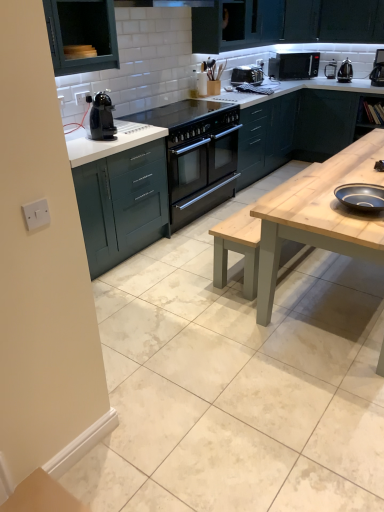
Question: Is natural wood table at center further to camera compared to green matte cabinet at upper center, the third cabinetry positioned from the left?

Choices:
 (A) no
 (B) yes

Answer: (A)

Question: Can you confirm if natural wood table at center is positioned to the left of green matte cabinet at upper center, the 2th cabinetry positioned from the right?

Choices:
 (A) yes
 (B) no

Answer: (B)

Question: Would you say natural wood table at center is a long distance from green matte cabinet at upper center, the third cabinetry positioned from the left?

Choices:
 (A) no
 (B) yes

Answer: (B)

Question: Can you confirm if natural wood table at center is shorter than green matte cabinet at upper center, the 2th cabinetry positioned from the right?

Choices:
 (A) no
 (B) yes

Answer: (A)

Question: Is natural wood table at center not within green matte cabinet at upper center, the third cabinetry positioned from the left?

Choices:
 (A) yes
 (B) no

Answer: (A)

Question: Can you confirm if natural wood table at center is smaller than green matte cabinet at upper center, the 2th cabinetry positioned from the right?

Choices:
 (A) no
 (B) yes

Answer: (A)

Question: Is black glass cooktop at center with natural wood table at center?

Choices:
 (A) yes
 (B) no

Answer: (B)

Question: From a real-world perspective, is black glass cooktop at center over natural wood table at center?

Choices:
 (A) no
 (B) yes

Answer: (B)

Question: Can you confirm if black glass cooktop at center is taller than natural wood table at center?

Choices:
 (A) yes
 (B) no

Answer: (B)

Question: Is black glass cooktop at center turned away from natural wood table at center?

Choices:
 (A) yes
 (B) no

Answer: (B)

Question: Is black glass cooktop at center aimed at natural wood table at center?

Choices:
 (A) no
 (B) yes

Answer: (A)

Question: From the image's perspective, is black glass cooktop at center below natural wood table at center?

Choices:
 (A) yes
 (B) no

Answer: (B)

Question: From a real-world perspective, is black metallic kettle at upper right, which is the 3th appliance from left to right, beneath teal wood cabinet at upper left, arranged as the 1th cabinetry when viewed from the left?

Choices:
 (A) no
 (B) yes

Answer: (B)